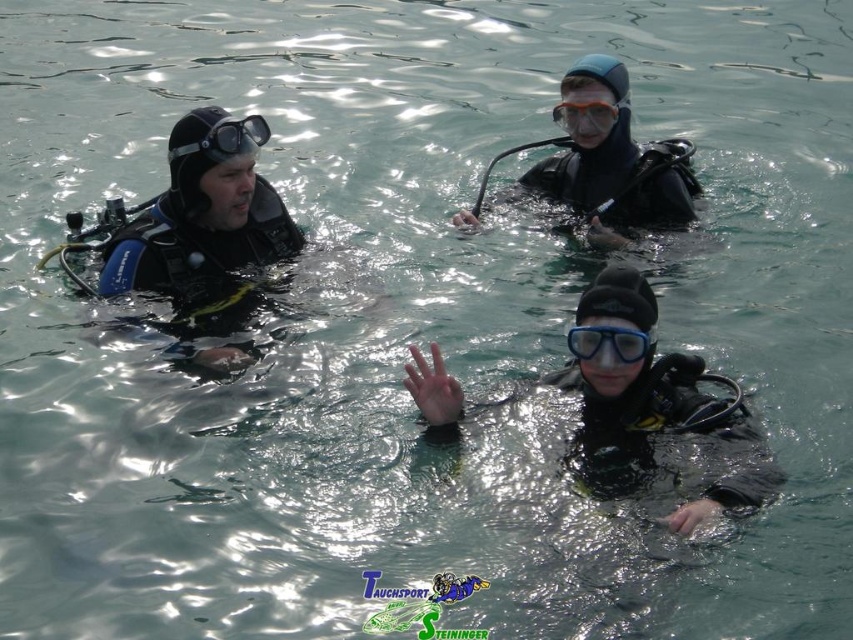
Question: Can you confirm if black matte wetsuit at left is positioned below matte black goggles at upper left?

Choices:
 (A) no
 (B) yes

Answer: (B)

Question: Which point is closer to the camera?

Choices:
 (A) black matte wetsuit at upper center
 (B) black matte wetsuit at center
 (C) black matte wetsuit at left
 (D) transparent orange goggles at center

Answer: (B)

Question: Which of the following is the closest to the observer?

Choices:
 (A) black matte wetsuit at left
 (B) matte black goggles at upper left
 (C) transparent orange goggles at center
 (D) black matte wetsuit at upper center

Answer: (B)

Question: Which object is the farthest from the transparent rubber goggles at center?

Choices:
 (A) matte black goggles at upper left
 (B) transparent orange goggles at center

Answer: (B)

Question: In this image, where is black matte wetsuit at left located relative to transparent rubber goggles at center?

Choices:
 (A) below
 (B) above

Answer: (B)

Question: Can you confirm if black matte wetsuit at center is positioned to the right of transparent rubber goggles at center?

Choices:
 (A) no
 (B) yes

Answer: (B)